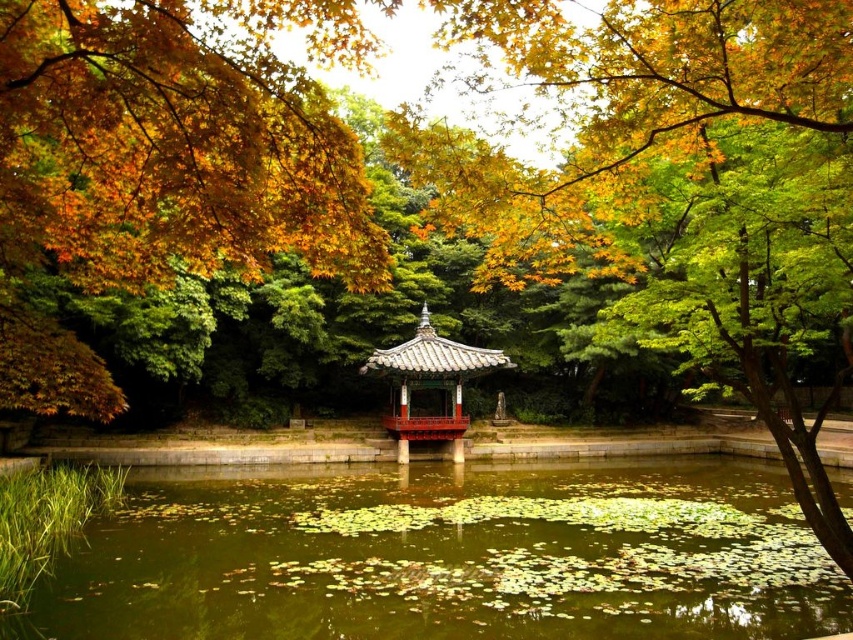
Question: Which point is closer to the camera taking this photo?

Choices:
 (A) (447, 346)
 (B) (234, 584)

Answer: (B)

Question: Which object appears farthest from the camera in this image?

Choices:
 (A) matte black gazebo at center
 (B) green mossy water at center

Answer: (A)

Question: From the image, what is the correct spatial relationship of green mossy water at center in relation to matte black gazebo at center?

Choices:
 (A) below
 (B) above

Answer: (A)

Question: Can you confirm if green mossy water at center is bigger than matte black gazebo at center?

Choices:
 (A) no
 (B) yes

Answer: (B)

Question: Is green mossy water at center behind matte black gazebo at center?

Choices:
 (A) no
 (B) yes

Answer: (A)

Question: Which object appears closest to the camera in this image?

Choices:
 (A) matte black gazebo at center
 (B) green mossy water at center

Answer: (B)